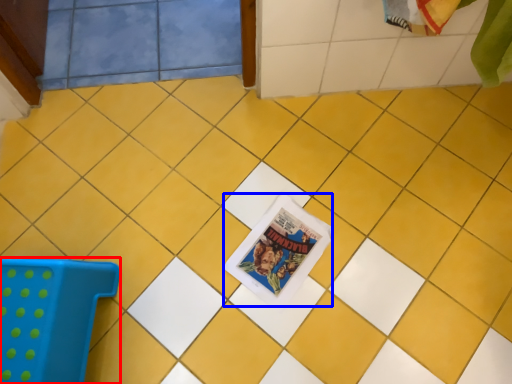
Question: Which point is further to the camera, furniture (highlighted by a red box) or comic book (highlighted by a blue box)?

Choices:
 (A) furniture
 (B) comic book

Answer: (B)